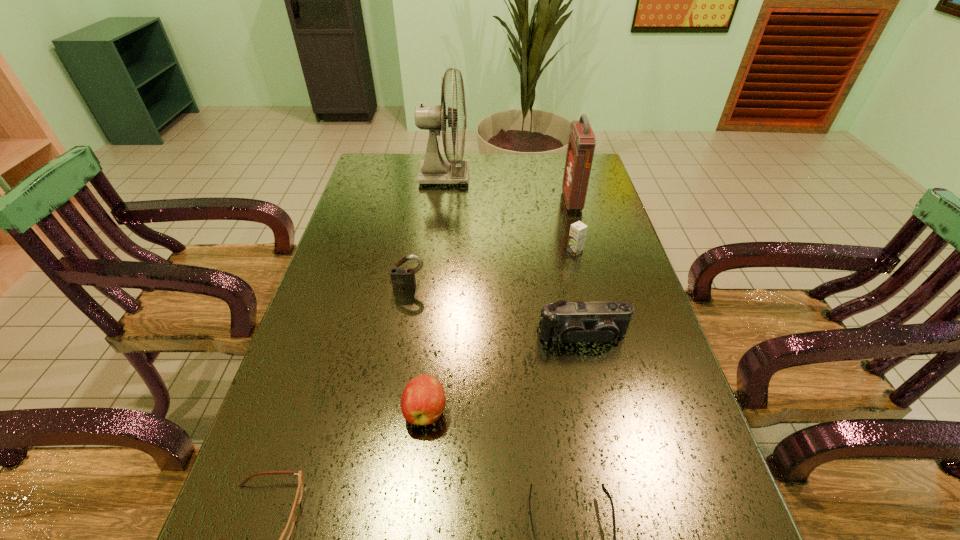
Identify the location of fan. tap(434, 169).

Find the location of `the seventh shortest object`. the seventh shortest object is located at coordinates (581, 145).

Find the location of a particular element. Image resolution: width=960 pixels, height=540 pixels. the fourth farthest object is located at coordinates (401, 278).

Locate an element on the screen. This screenshot has width=960, height=540. camcorder is located at coordinates (603, 322).

You are a GUI agent. You are given a task and a screenshot of the screen. Output one action in this format:
    pyautogui.click(x=<x>, y=<y>)
    Task: Click on the chocolate milk
    The image size is (960, 540).
    Given the screenshot: What is the action you would take?
    pos(578,230)

Identify the location of the sixth farthest object. pos(423,400).

Find the location of `free space located on the front-facing side of the fan`. free space located on the front-facing side of the fan is located at coordinates (486, 176).

Find the location of `vacant region located 0.220m on the front-facing side of the seventh shortest object`. vacant region located 0.220m on the front-facing side of the seventh shortest object is located at coordinates (499, 201).

You are a GUI agent. You are given a task and a screenshot of the screen. Output one action in this format:
    pyautogui.click(x=<x>, y=<y>)
    Task: Click on the vacant space located 0.120m on the front-facing side of the seventh shortest object
    This screenshot has height=540, width=960.
    Given the screenshot: What is the action you would take?
    pyautogui.click(x=529, y=201)

Locate an element on the screen. blank space located on the front-facing side of the seventh shortest object is located at coordinates (540, 201).